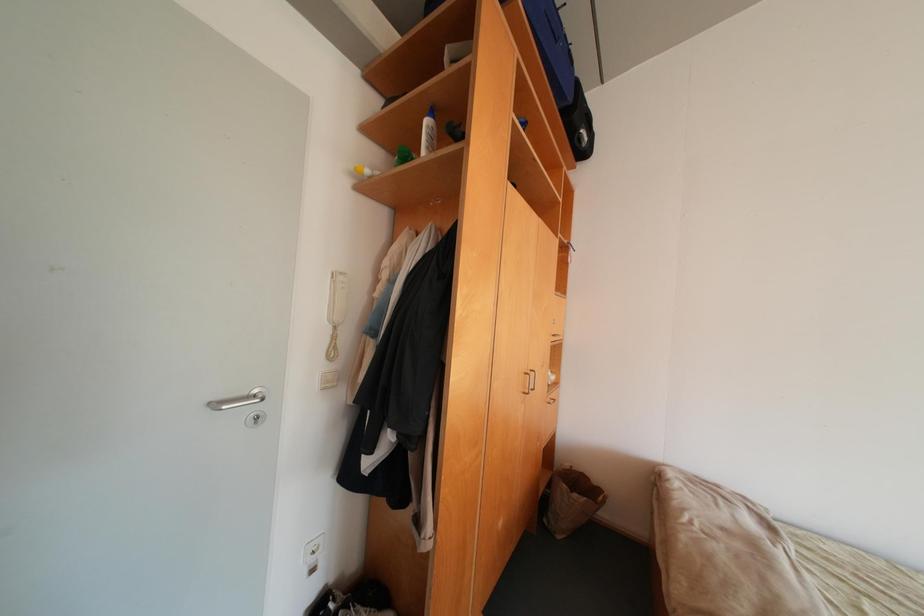
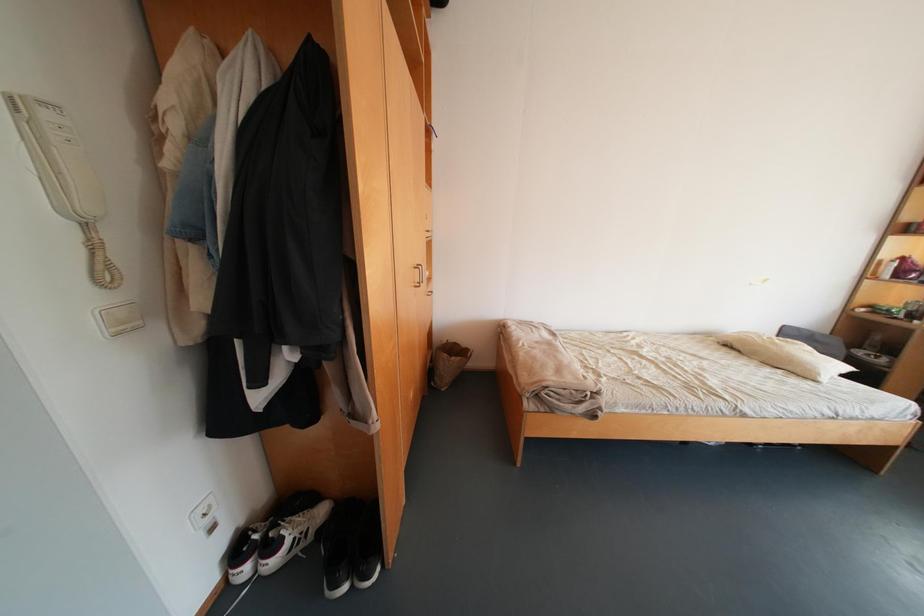
Based on the photo, first-person continuous shooting, in which direction is the camera rotating?

The rotation direction of the camera is right-down.